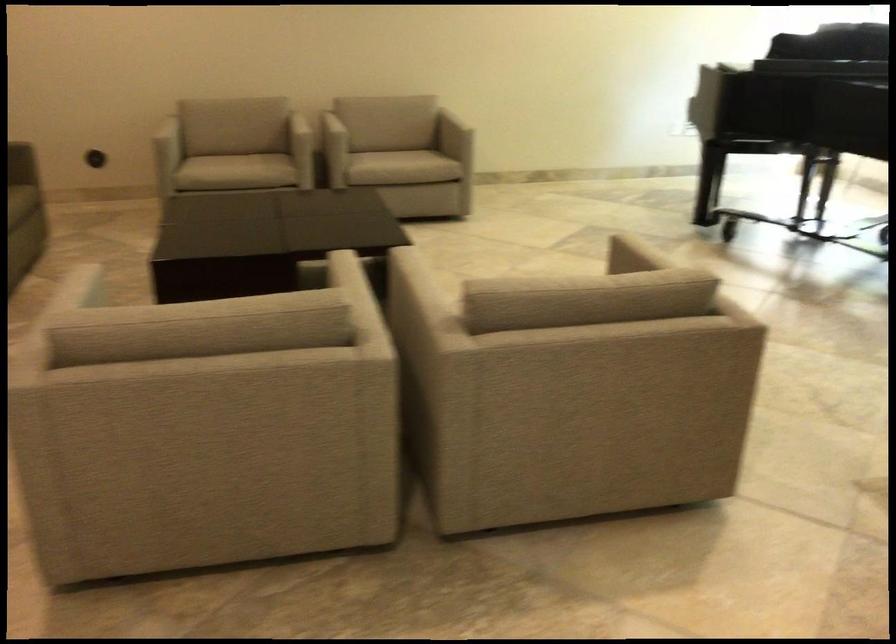
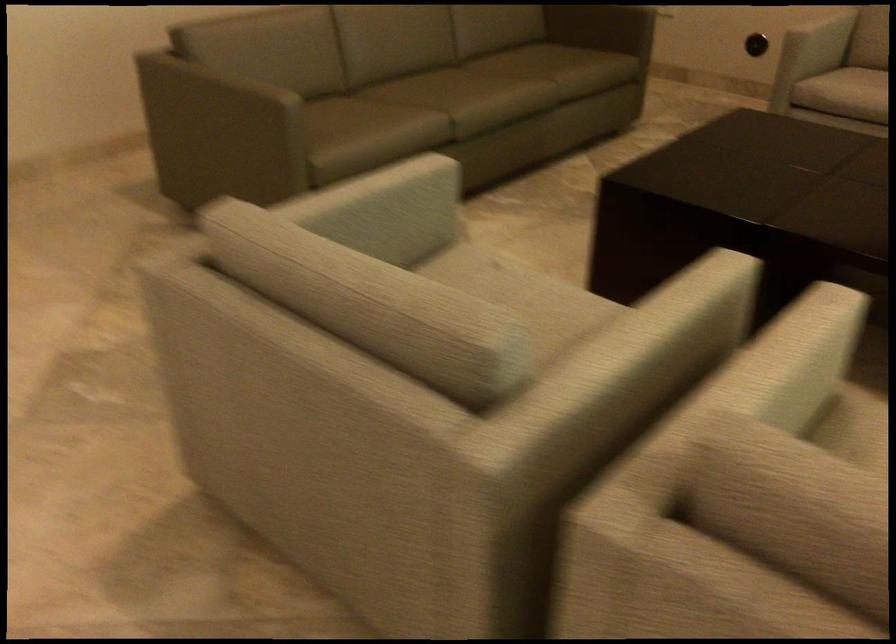
Locate, in the second image, the point that corresponds to [501,283] in the first image.

(806, 468)